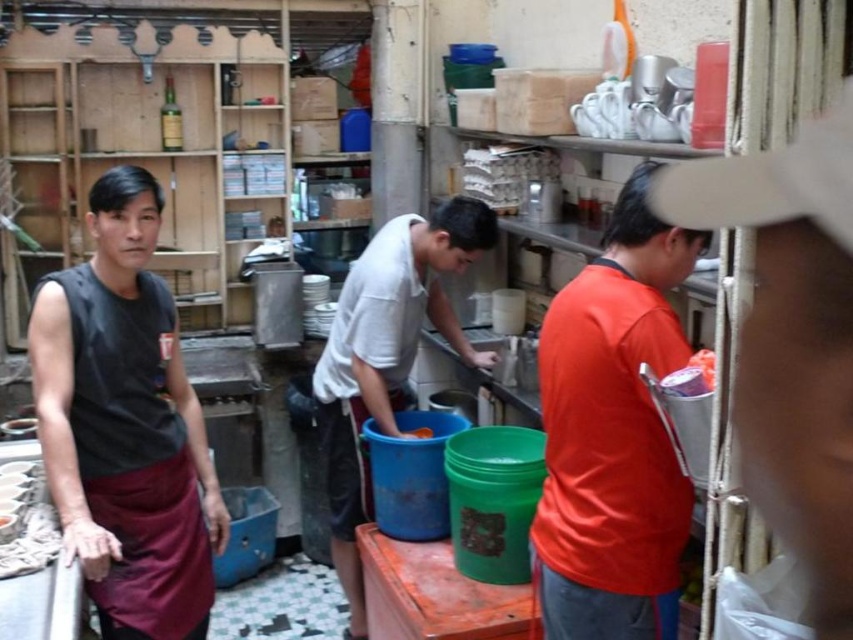
You are standing in the kitchen and need to reach both the point at coordinates (x=125, y=198) and the point at (x=669, y=582). Which point should you approach first to reach the closer one first?

You should approach point (x=125, y=198) first because it is closer to you than point (x=669, y=582), which is further away.

Looking at this image, you are a new employee in this kitchen and need to identify the staff members. Which staff member has a thinner torso? Please choose between the orange matte shirt at right and the white matte shirt at center.

The orange matte shirt at right has a thinner torso than the white matte shirt at center.

In the kitchen scene, there are three people. The first person is wearing a dark sleeveless shirt and a red apron at the left. The second person is in a white t shirt and dark shorts at the center, washing dishes. The third person is in a bright orange shirt and dark pants at the right. Now, you are standing at the point with coordinates point (125,426), which is labeled as black sleeveless shirt at left. If you want to move towards the third person in the bright orange shirt and dark pants at the right,

The point (125,426) indicates the black sleeveless shirt at left, so moving towards the third person in the bright orange shirt and dark pants at the right would require moving from the left towards the right side of the scene.